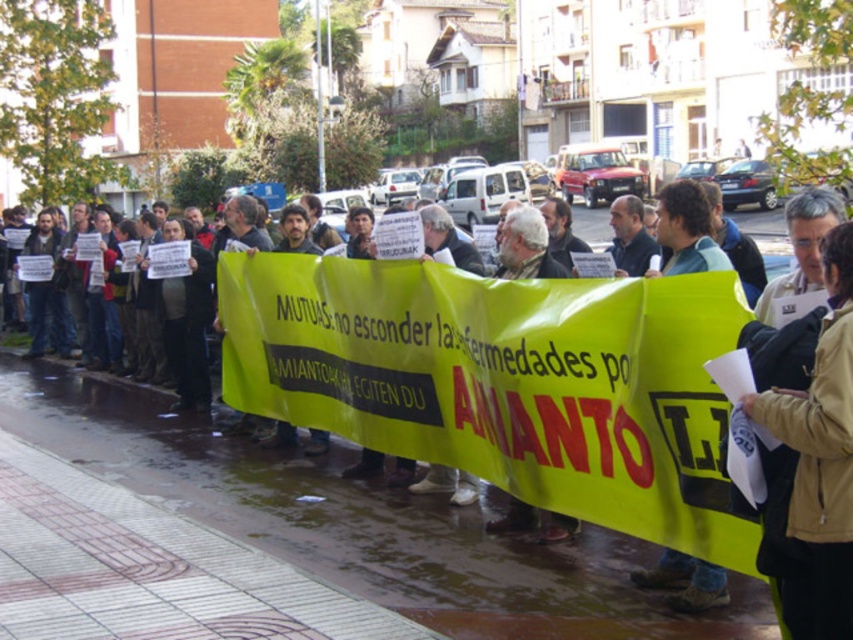
Does dark brown leather jacket at center come behind light brown leather jacket at center?

No, it is not.

Does point (486, 408) come behind point (672, 211)?

Yes, it is behind point (672, 211).

Is point (125, 508) positioned in front of point (660, 195)?

That is False.

Find the location of a particular element. The image size is (853, 640). dark brown leather jacket at center is located at coordinates (173, 531).

Who is taller, dark brown leather jacket at center or brown leather jacket at lower right?

With more height is brown leather jacket at lower right.

Is point (315, 314) closer to camera compared to point (837, 387)?

No, (315, 314) is further to viewer.

Does point (347, 632) lie behind point (813, 593)?

Yes, it is behind point (813, 593).

The image size is (853, 640). Identify the location of dark brown leather jacket at center. (173, 531).

Is brown leather jacket at lower right to the right of light brown leather jacket at center from the viewer's perspective?

Result: No, brown leather jacket at lower right is not to the right of light brown leather jacket at center.

Which of these two, brown leather jacket at lower right or light brown leather jacket at center, stands taller?

light brown leather jacket at center is taller.

Locate an element on the screen. Image resolution: width=853 pixels, height=640 pixels. brown leather jacket at lower right is located at coordinates (822, 444).

I want to click on brown leather jacket at lower right, so click(x=822, y=444).